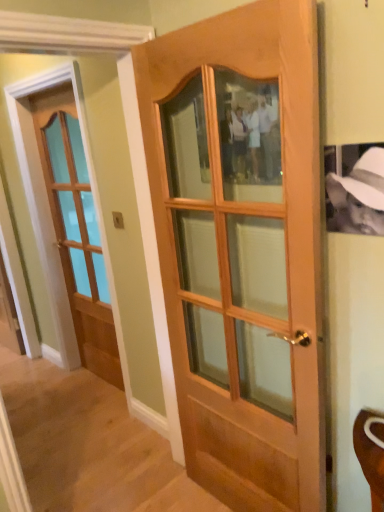
The image size is (384, 512). Describe the element at coordinates (76, 230) in the screenshot. I see `matte wooden door at left, which ranks as the second door in front-to-back order` at that location.

Where is `matte wooden door at left, the first door in the back-to-front sequence`? matte wooden door at left, the first door in the back-to-front sequence is located at coordinates (76, 230).

Image resolution: width=384 pixels, height=512 pixels. I want to click on wooden door at center, which appears as the 2th door when viewed from the back, so click(x=240, y=258).

Describe the element at coordinates (240, 258) in the screenshot. Image resolution: width=384 pixels, height=512 pixels. I see `wooden door at center, marked as the 1th door in a front-to-back arrangement` at that location.

Identify the location of matte wooden door at left, the first door in the back-to-front sequence. The width and height of the screenshot is (384, 512). (76, 230).

Is matte wooden door at left, the first door in the back-to-front sequence, to the left of wooden door at center, which appears as the 2th door when viewed from the back, from the viewer's perspective?

Correct, you'll find matte wooden door at left, the first door in the back-to-front sequence, to the left of wooden door at center, which appears as the 2th door when viewed from the back.

Is the position of matte wooden door at left, the first door in the back-to-front sequence, more distant than that of wooden door at center, acting as the first door starting from the right?

Yes.

Is point (49, 185) positioned before point (302, 455)?

No, it is not.

From the picture: From the image's perspective, is matte wooden door at left, which ranks as the second door in front-to-back order, below wooden door at center, marked as the 1th door in a front-to-back arrangement?

Incorrect, from the image's perspective, matte wooden door at left, which ranks as the second door in front-to-back order, is higher than wooden door at center, marked as the 1th door in a front-to-back arrangement.

From a real-world perspective, is matte wooden door at left, the 1th door viewed from the left, located higher than wooden door at center, marked as the 1th door in a front-to-back arrangement?

Yes, from a real-world perspective, matte wooden door at left, the 1th door viewed from the left, is above wooden door at center, marked as the 1th door in a front-to-back arrangement.

Between matte wooden door at left, the 1th door viewed from the left, and wooden door at center, acting as the first door starting from the right, which one has smaller width?

matte wooden door at left, the 1th door viewed from the left, is thinner.

Is matte wooden door at left, the first door in the back-to-front sequence, shorter than wooden door at center, which appears as the 2th door when viewed from the back?

No.

Can you confirm if matte wooden door at left, the first door in the back-to-front sequence, is bigger than wooden door at center, acting as the first door starting from the right?

No, matte wooden door at left, the first door in the back-to-front sequence, is not bigger than wooden door at center, acting as the first door starting from the right.

Is wooden door at center, which appears as the 2th door when viewed from the back, a part of matte wooden door at left, the 1th door viewed from the left?

No, wooden door at center, which appears as the 2th door when viewed from the back, is located outside of matte wooden door at left, the 1th door viewed from the left.

Is matte wooden door at left, the first door in the back-to-front sequence, oriented towards wooden door at center, marked as the 1th door in a front-to-back arrangement?

No, matte wooden door at left, the first door in the back-to-front sequence, is not turned towards wooden door at center, marked as the 1th door in a front-to-back arrangement.

How many degrees apart are the facing directions of matte wooden door at left, the first door in the back-to-front sequence, and wooden door at center, which appears as the 2th door when viewed from the back?

The facing directions of matte wooden door at left, the first door in the back-to-front sequence, and wooden door at center, which appears as the 2th door when viewed from the back, are 0.861 degrees apart.

How much distance is there between matte wooden door at left, placed as the second door when sorted from right to left, and wooden door at center, which appears as the 2th door when viewed from the back?

The distance of matte wooden door at left, placed as the second door when sorted from right to left, from wooden door at center, which appears as the 2th door when viewed from the back, is 4.10 feet.

Identify the location of door above the wooden door at center, which appears as the 2th door when viewed from the back (from the image's perspective). (76, 230).

Is wooden door at center, the 2th door from the left, at the left side of matte wooden door at left, the 1th door viewed from the left?

In fact, wooden door at center, the 2th door from the left, is to the right of matte wooden door at left, the 1th door viewed from the left.

Considering the positions of objects wooden door at center, marked as the 1th door in a front-to-back arrangement, and matte wooden door at left, which ranks as the second door in front-to-back order, in the image provided, who is behind, wooden door at center, marked as the 1th door in a front-to-back arrangement, or matte wooden door at left, which ranks as the second door in front-to-back order,?

matte wooden door at left, which ranks as the second door in front-to-back order, is more distant.

Considering the positions of point (245, 309) and point (71, 311), is point (245, 309) closer or farther from the camera than point (71, 311)?

Point (245, 309).

From the image's perspective, would you say wooden door at center, marked as the 1th door in a front-to-back arrangement, is positioned over matte wooden door at left, the 1th door viewed from the left?

No.

From a real-world perspective, is wooden door at center, marked as the 1th door in a front-to-back arrangement, physically above matte wooden door at left, placed as the second door when sorted from right to left?

No.

Between wooden door at center, the 2th door from the left, and matte wooden door at left, the 1th door viewed from the left, which one has larger width?

With larger width is wooden door at center, the 2th door from the left.

Who is taller, wooden door at center, which appears as the 2th door when viewed from the back, or matte wooden door at left, the 1th door viewed from the left?

Standing taller between the two is matte wooden door at left, the 1th door viewed from the left.

Between wooden door at center, the 2th door from the left, and matte wooden door at left, the 1th door viewed from the left, which one has larger size?

With larger size is wooden door at center, the 2th door from the left.

From the picture: Is matte wooden door at left, placed as the second door when sorted from right to left, completely or partially inside wooden door at center, the 2th door from the left?

No, wooden door at center, the 2th door from the left, does not contain matte wooden door at left, placed as the second door when sorted from right to left.

Does wooden door at center, the 2th door from the left, touch matte wooden door at left, placed as the second door when sorted from right to left?

wooden door at center, the 2th door from the left, is not next to matte wooden door at left, placed as the second door when sorted from right to left, and they're not touching.

Does wooden door at center, acting as the first door starting from the right, turn towards matte wooden door at left, which ranks as the second door in front-to-back order?

No, wooden door at center, acting as the first door starting from the right, is not turned towards matte wooden door at left, which ranks as the second door in front-to-back order.

Can you tell me how much wooden door at center, the 2th door from the left, and matte wooden door at left, placed as the second door when sorted from right to left, differ in facing direction?

0.861 degrees.

Could you measure the distance between wooden door at center, marked as the 1th door in a front-to-back arrangement, and matte wooden door at left, which ranks as the second door in front-to-back order?

wooden door at center, marked as the 1th door in a front-to-back arrangement, is 4.10 feet away from matte wooden door at left, which ranks as the second door in front-to-back order.

Identify the location of door located underneath the matte wooden door at left, the 1th door viewed from the left (from a real-world perspective). (240, 258).

I want to click on door in front of the matte wooden door at left, the 1th door viewed from the left, so click(240, 258).

This screenshot has width=384, height=512. I want to click on door that is above the wooden door at center, which appears as the 2th door when viewed from the back (from the image's perspective), so click(x=76, y=230).